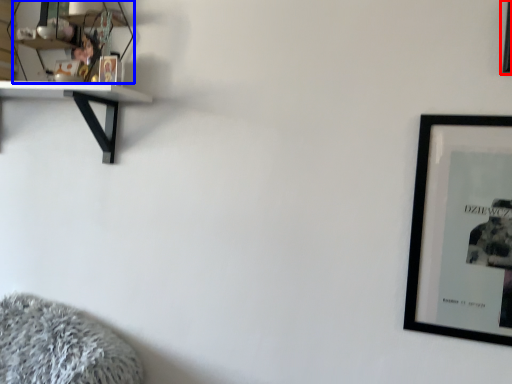
Question: Which object is closer to the camera taking this photo, picture frame (highlighted by a red box) or shelf (highlighted by a blue box)?

Choices:
 (A) picture frame
 (B) shelf

Answer: (A)